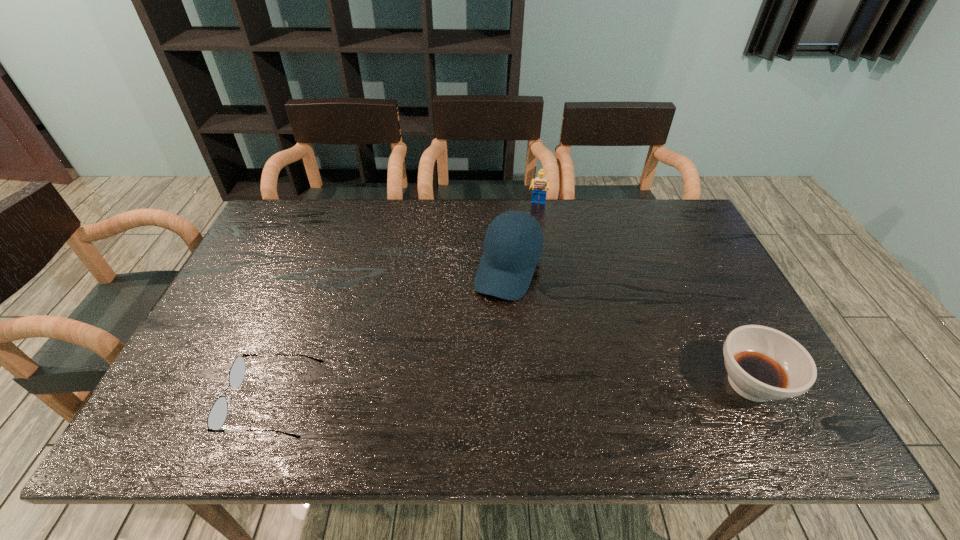
You are a GUI agent. You are given a task and a screenshot of the screen. Output one action in this format:
    pyautogui.click(x=<x>, y=<y>)
    Task: Click on the spectacles that is at the near edge
    
    Given the screenshot: What is the action you would take?
    pyautogui.click(x=218, y=413)

Locate an element on the screen. Image resolution: width=960 pixels, height=540 pixels. soup bowl that is at the near edge is located at coordinates (763, 364).

The height and width of the screenshot is (540, 960). I want to click on object situated at the left edge, so click(x=218, y=413).

At what (x,y) coordinates should I click in order to perform the action: click on object that is at the right edge. Please return your answer as a coordinate pair (x, y). Looking at the image, I should click on (763, 364).

Locate an element on the screen. The height and width of the screenshot is (540, 960). object situated at the near left corner is located at coordinates (218, 413).

This screenshot has height=540, width=960. Identify the location of object that is positioned at the near right corner. (763, 364).

In order to click on blank area at the far edge in this screenshot , I will do `click(636, 207)`.

Where is `vacant space at the near edge of the desktop`? vacant space at the near edge of the desktop is located at coordinates pos(702,370).

Locate an element on the screen. The image size is (960, 540). vacant space at the left edge of the desktop is located at coordinates (273, 267).

The height and width of the screenshot is (540, 960). Find the location of `vacant space at the right edge of the desktop`. vacant space at the right edge of the desktop is located at coordinates (750, 321).